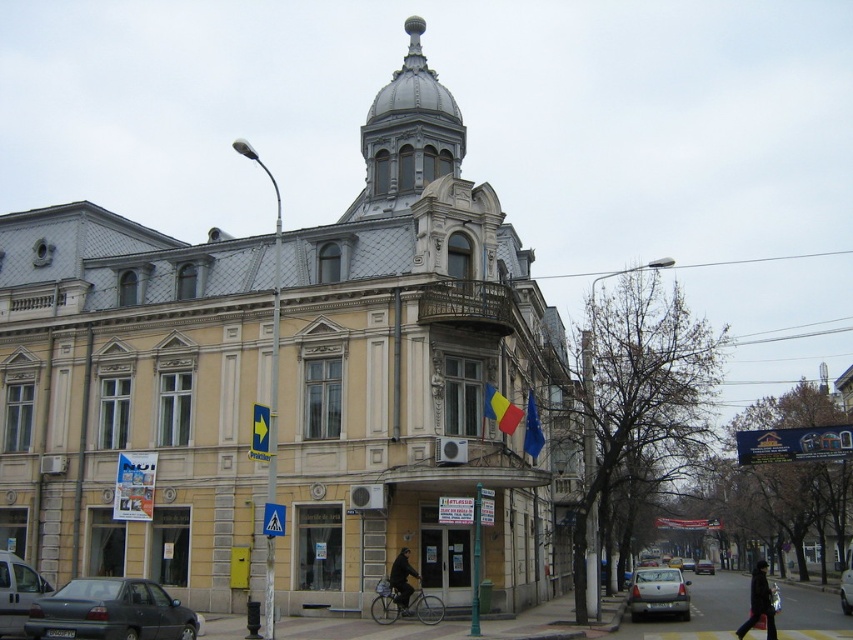
Does silver metallic car at center appear under silver metallic sedan at center?

No.

Measure the distance from silver metallic car at center to silver metallic sedan at center.

silver metallic car at center is 241.55 feet from silver metallic sedan at center.

The width and height of the screenshot is (853, 640). I want to click on silver metallic car at center, so click(x=659, y=593).

Who is taller, matte black car at lower left or dark blue jacket at center?

dark blue jacket at center

Is matte black car at lower left smaller than dark blue jacket at center?

No.

Which is behind, point (42, 634) or point (399, 589)?

Positioned behind is point (399, 589).

The width and height of the screenshot is (853, 640). I want to click on matte black car at lower left, so click(x=109, y=611).

Is matte black car at lower left shorter than white glossy car at center?

Yes, matte black car at lower left is shorter than white glossy car at center.

Find the location of a particular element. The image size is (853, 640). matte black car at lower left is located at coordinates (109, 611).